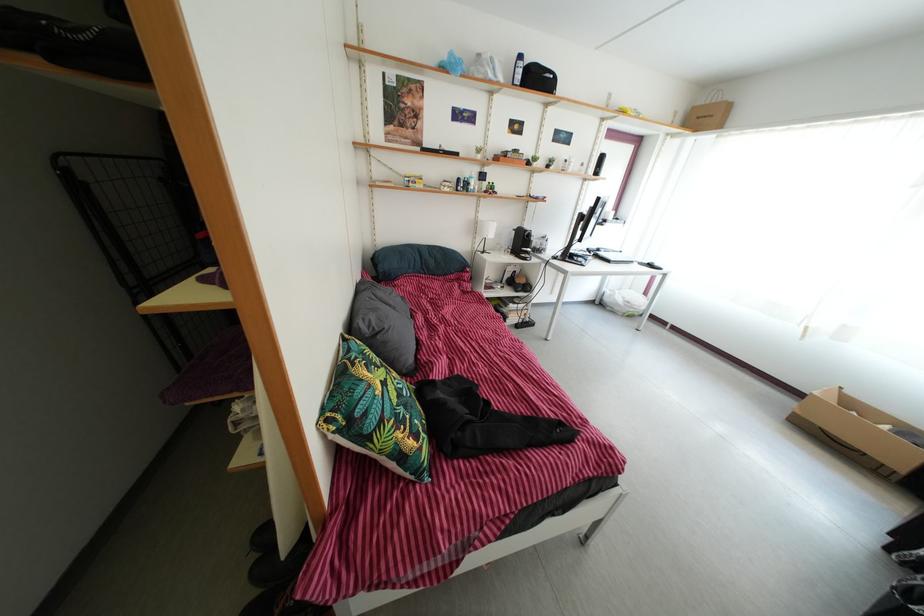
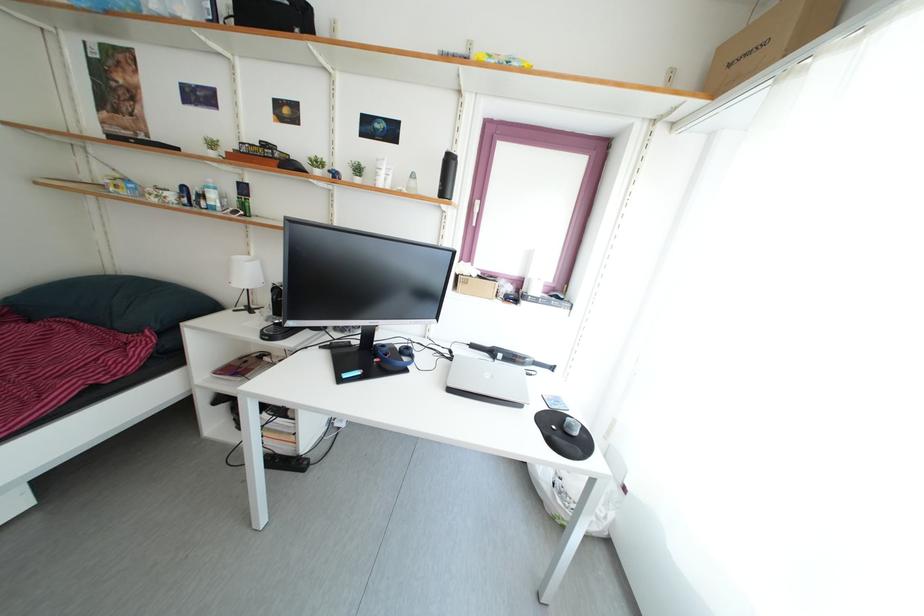
The images are taken continuously from a first-person perspective. In which direction are you moving?

The cameraman moved toward right, forward.